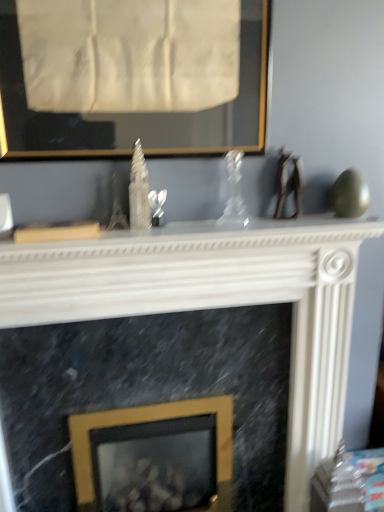
Locate an element on the screen. This screenshot has width=384, height=512. vacant space that is to the left of transparent glass vase at center is located at coordinates (175, 232).